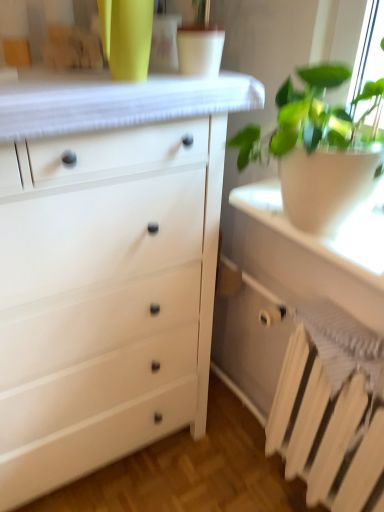
Question: Is white painted metal radiator at lower right beside white matte pot at right?

Choices:
 (A) no
 (B) yes

Answer: (A)

Question: Considering the relative sizes of white painted metal radiator at lower right and white matte pot at right in the image provided, is white painted metal radiator at lower right thinner than white matte pot at right?

Choices:
 (A) yes
 (B) no

Answer: (A)

Question: Considering the relative sizes of white painted metal radiator at lower right and white matte pot at right in the image provided, is white painted metal radiator at lower right smaller than white matte pot at right?

Choices:
 (A) no
 (B) yes

Answer: (B)

Question: From the image's perspective, is white painted metal radiator at lower right under white matte pot at right?

Choices:
 (A) yes
 (B) no

Answer: (A)

Question: Is white painted metal radiator at lower right at the left side of white matte pot at right?

Choices:
 (A) yes
 (B) no

Answer: (B)

Question: Does white painted metal radiator at lower right lie behind white matte pot at right?

Choices:
 (A) yes
 (B) no

Answer: (A)

Question: From the image's perspective, is white matte pot at right located above white painted metal radiator at lower right?

Choices:
 (A) no
 (B) yes

Answer: (B)

Question: Is white matte pot at right outside of white painted metal radiator at lower right?

Choices:
 (A) yes
 (B) no

Answer: (A)

Question: Considering the relative positions of white matte pot at right and white painted metal radiator at lower right in the image provided, is white matte pot at right in front of white painted metal radiator at lower right?

Choices:
 (A) no
 (B) yes

Answer: (B)

Question: Can you confirm if white matte pot at right is taller than white painted metal radiator at lower right?

Choices:
 (A) no
 (B) yes

Answer: (B)

Question: Can white painted metal radiator at lower right be found inside white matte pot at right?

Choices:
 (A) yes
 (B) no

Answer: (B)

Question: Is white matte pot at right shorter than white painted metal radiator at lower right?

Choices:
 (A) yes
 (B) no

Answer: (B)

Question: Would you consider white matte chest of drawers at left to be distant from white painted metal radiator at lower right?

Choices:
 (A) no
 (B) yes

Answer: (A)